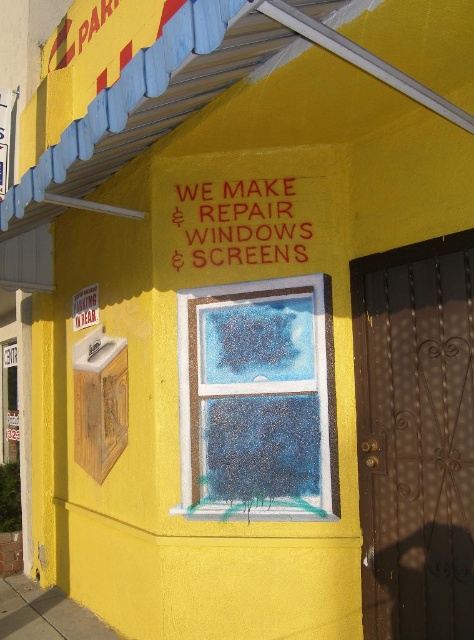
Question: Can you confirm if blue frosted glass window at center is positioned above red rubber sign at center?

Choices:
 (A) yes
 (B) no

Answer: (B)

Question: Can you confirm if blue frosted glass window at center is positioned to the right of red rubber sign at center?

Choices:
 (A) yes
 (B) no

Answer: (A)

Question: Which of the following is the farthest from the observer?

Choices:
 (A) (222, 413)
 (B) (290, 220)

Answer: (B)

Question: Which point appears farthest from the camera in this image?

Choices:
 (A) (172, 218)
 (B) (311, 426)

Answer: (A)

Question: Does blue frosted glass window at center have a lesser width compared to red rubber sign at center?

Choices:
 (A) no
 (B) yes

Answer: (A)

Question: Among these points, which one is farthest from the camera?

Choices:
 (A) (262, 484)
 (B) (182, 227)

Answer: (B)